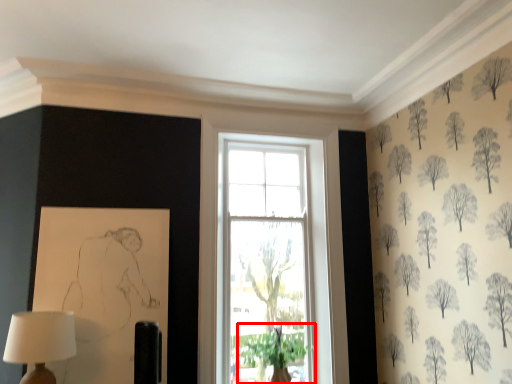
Question: From the image's perspective, where is plant (annotated by the red box) located relative to table lamp?

Choices:
 (A) above
 (B) below

Answer: (B)